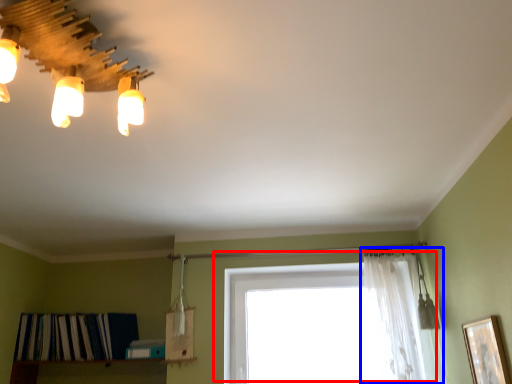
Question: Which object appears closest to the camera in this image, window (highlighted by a red box) or curtain (highlighted by a blue box)?

Choices:
 (A) window
 (B) curtain

Answer: (B)